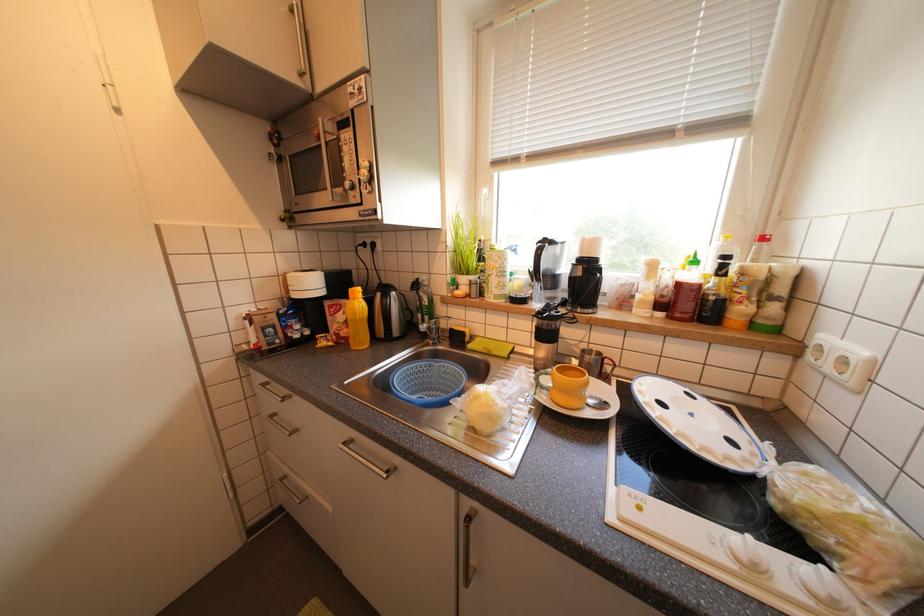
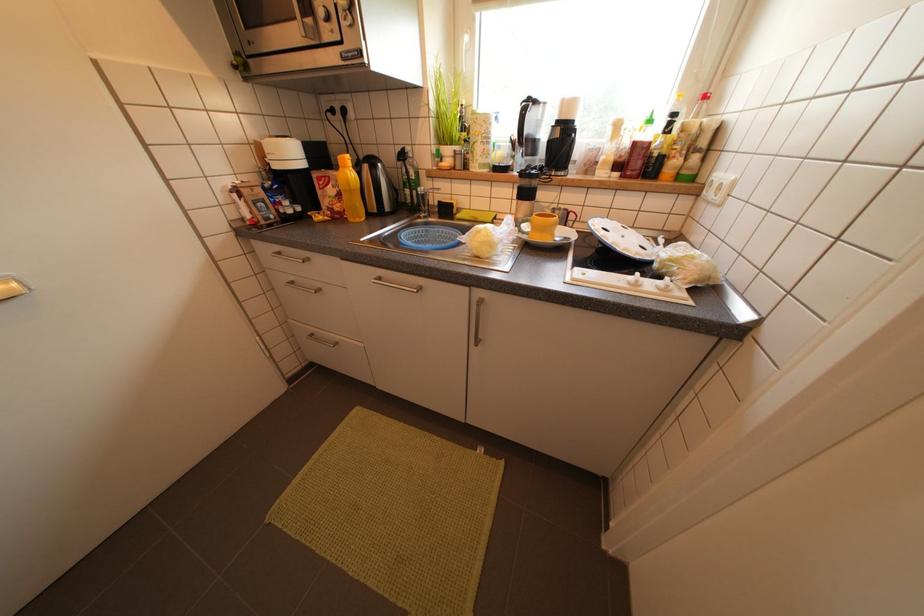
The images are taken continuously from a first-person perspective. In which direction are you moving?

The movement direction of the cameraman is left, backward.